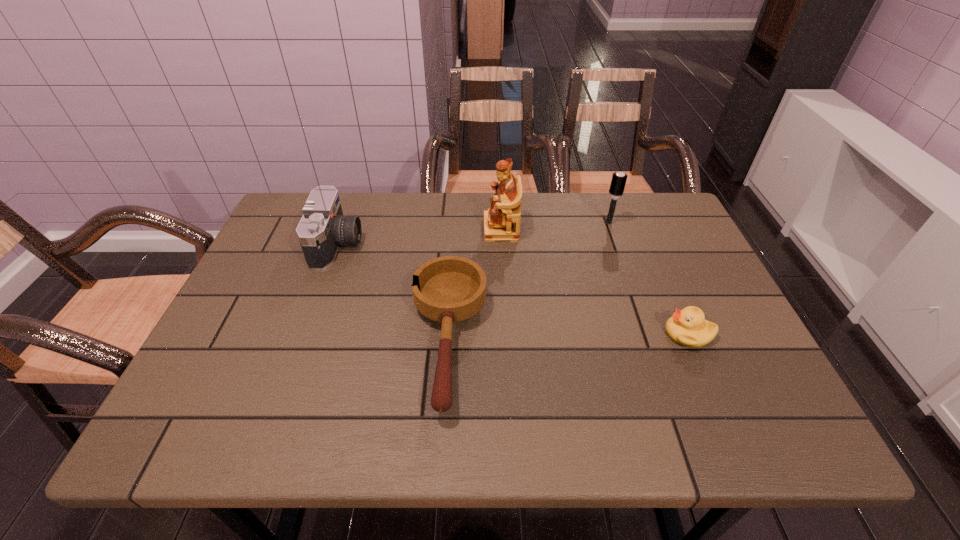
This screenshot has width=960, height=540. I want to click on free space located 0.260m on the left of the second object from right to left, so click(514, 222).

Find the location of a particular element. blank area located 0.290m on the front-facing side of the leftmost object is located at coordinates (466, 245).

Locate an element on the screen. The height and width of the screenshot is (540, 960). vacant region located at the face of the duckling is located at coordinates (512, 333).

Locate an element on the screen. vacant space located 0.100m at the face of the duckling is located at coordinates (621, 333).

Locate an element on the screen. vacant region located 0.150m at the face of the duckling is located at coordinates (600, 333).

Where is `figurine present at the far edge`? The image size is (960, 540). figurine present at the far edge is located at coordinates (502, 221).

You are a GUI agent. You are given a task and a screenshot of the screen. Output one action in this format:
    pyautogui.click(x=<x>, y=<y>)
    Task: Click on the hairbrush that is at the far edge
    The image size is (960, 540).
    Given the screenshot: What is the action you would take?
    pyautogui.click(x=618, y=181)

Where is `camera at the far edge`? This screenshot has width=960, height=540. camera at the far edge is located at coordinates (323, 228).

This screenshot has width=960, height=540. Identify the location of object that is at the near edge. (447, 289).

At what (x,y) coordinates should I click in order to perform the action: click on object that is at the left edge. Please return your answer as a coordinate pair (x, y). Image resolution: width=960 pixels, height=540 pixels. Looking at the image, I should click on (323, 228).